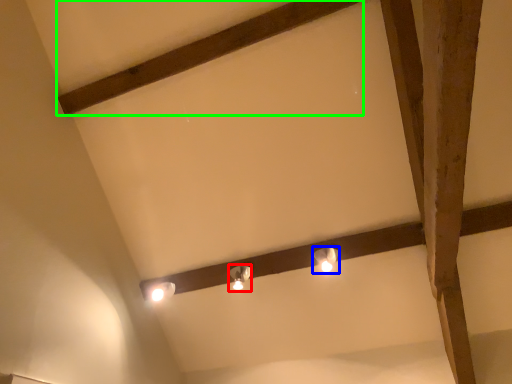
Question: Estimate the real-world distances between objects in this image. Which object is farther from lamp (highlighted by a red box), lamp (highlighted by a blue box) or plank (highlighted by a green box)?

Choices:
 (A) lamp
 (B) plank

Answer: (B)